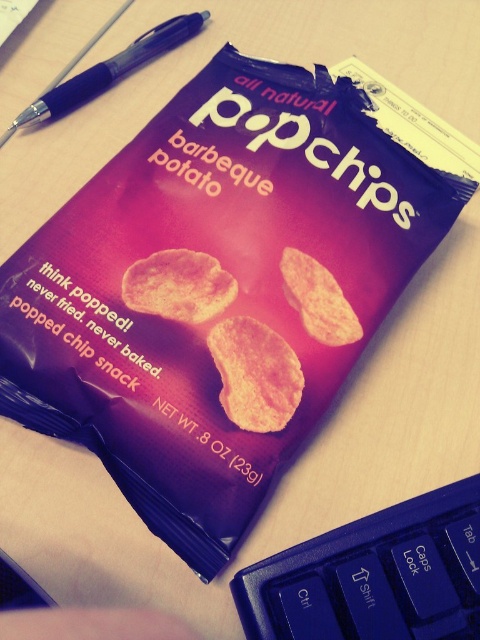
You are designing a layout for a product packaging and need to ensure proper placement of elements. Given the current arrangement of the matte orange chip at center and the black plastic pen at upper left, which element is positioned higher up on the packaging?

The black plastic pen at upper left is positioned higher up on the packaging than the matte orange chip at center.

You are designing a promotional poster for Popchips. You have a matte orange chip at center and a black plastic pen at upper left. Which object should you place closer to the viewer to highlight the chip?

The matte orange chip at center should be placed closer to the viewer since it is in front of the black plastic pen at upper left, making it the focal point.

You are holding a Popchips packet and want to place a sticker on the side closer to you. Which point, point (206, 339) or point (90, 68), should you choose?

Point (206, 339) is closer to the camera, so you should choose point (206, 339) to place the sticker.